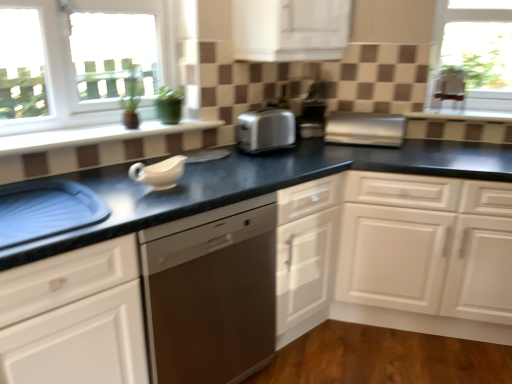
What is the approximate width of white matte cabinet at center, which appears as the 2th cabinetry when viewed from the top?

white matte cabinet at center, which appears as the 2th cabinetry when viewed from the top, is 61.56 centimeters wide.

At what (x,y) coordinates should I click in order to perform the action: click on white ceramic window sill at upper left. Please return your answer as a coordinate pair (x, y). The image size is (512, 384). Looking at the image, I should click on (94, 135).

At what (x,y) coordinates should I click in order to perform the action: click on satin silver coffee machine at center. Please return your answer as a coordinate pair (x, y). This screenshot has width=512, height=384. Looking at the image, I should click on (314, 111).

From the picture: Measure the distance between satin silver coffee machine at center and camera.

The depth of satin silver coffee machine at center is 7.94 feet.

Measure the distance between point (342, 44) and camera.

The distance of point (342, 44) from camera is 7.00 feet.

In order to face white glossy cabinet at upper center, the second cabinetry ordered from the bottom, should I rotate leftwards or rightwards?

It's best to rotate right around 5.376 degrees.

The height and width of the screenshot is (384, 512). Find the location of `satin silver toaster at center`. satin silver toaster at center is located at coordinates (265, 130).

Is white glossy cabinet at upper center, the 1th cabinetry when ordered from top to bottom, smaller than satin silver toaster at center?

Incorrect, white glossy cabinet at upper center, the 1th cabinetry when ordered from top to bottom, is not smaller in size than satin silver toaster at center.

Considering the relative sizes of white glossy cabinet at upper center, the 1th cabinetry when ordered from top to bottom, and satin silver toaster at center in the image provided, is white glossy cabinet at upper center, the 1th cabinetry when ordered from top to bottom, thinner than satin silver toaster at center?

No.

Is white glossy cabinet at upper center, the 1th cabinetry when ordered from top to bottom, inside or outside of satin silver toaster at center?

The correct answer is: outside.

Considering the points (309, 59) and (372, 114), which point is in front, point (309, 59) or point (372, 114)?

The point (309, 59) is closer to the camera.

From a real-world perspective, between stainless steel dishwasher at center and satin silver coffee machine at center, who is vertically higher?

From a 3D spatial view, satin silver coffee machine at center is above.

Could you tell me if stainless steel dishwasher at center is turned towards satin silver coffee machine at center?

No, stainless steel dishwasher at center is not aimed at satin silver coffee machine at center.

Does stainless steel dishwasher at center have a greater height compared to satin silver coffee machine at center?

Yes.

Considering the relative sizes of white glossy cabinet at upper center, the second cabinetry ordered from the bottom, and blue plastic tray at lower left in the image provided, is white glossy cabinet at upper center, the second cabinetry ordered from the bottom, smaller than blue plastic tray at lower left?

Actually, white glossy cabinet at upper center, the second cabinetry ordered from the bottom, might be larger than blue plastic tray at lower left.

Is white glossy cabinet at upper center, the second cabinetry ordered from the bottom, next to blue plastic tray at lower left and touching it?

No, white glossy cabinet at upper center, the second cabinetry ordered from the bottom, is not beside blue plastic tray at lower left.

How different are the orientations of white glossy cabinet at upper center, the 1th cabinetry when ordered from top to bottom, and blue plastic tray at lower left in degrees?

0.294 degrees.

Looking at this image, is white glossy cabinet at upper center, the second cabinetry ordered from the bottom, positioned with its back to blue plastic tray at lower left?

No, white glossy cabinet at upper center, the second cabinetry ordered from the bottom,'s orientation is not away from blue plastic tray at lower left.

Considering the sizes of blue plastic tray at lower left and satin silver toaster at center in the image, is blue plastic tray at lower left bigger or smaller than satin silver toaster at center?

Clearly, blue plastic tray at lower left is larger in size than satin silver toaster at center.

Measure the distance between blue plastic tray at lower left and satin silver toaster at center.

blue plastic tray at lower left is 4.60 feet away from satin silver toaster at center.

Consider the image. Is blue plastic tray at lower left turned away from satin silver toaster at center?

No, satin silver toaster at center is not at the back of blue plastic tray at lower left.

Consider the image. Who is bigger, white ceramic window sill at upper left or satin silver coffee machine at center?

With larger size is white ceramic window sill at upper left.

Is white ceramic window sill at upper left not inside satin silver coffee machine at center?

Yes, white ceramic window sill at upper left is outside of satin silver coffee machine at center.

From a real-world perspective, which is physically below, white ceramic window sill at upper left or satin silver coffee machine at center?

white ceramic window sill at upper left.

Is satin silver coffee machine at center smaller than stainless steel dishwasher at center?

Correct, satin silver coffee machine at center occupies less space than stainless steel dishwasher at center.

I want to click on dishwasher beneath the satin silver coffee machine at center (from a real-world perspective), so click(211, 293).

Between satin silver coffee machine at center and stainless steel dishwasher at center, which one appears on the left side from the viewer's perspective?

From the viewer's perspective, stainless steel dishwasher at center appears more on the left side.

From the image's perspective, is satin silver coffee machine at center above stainless steel dishwasher at center?

Yes, from the image's perspective, satin silver coffee machine at center is above stainless steel dishwasher at center.

Does stainless steel dishwasher at center have a smaller size compared to satin silver toaster at center?

No, stainless steel dishwasher at center is not smaller than satin silver toaster at center.

Which of these two, stainless steel dishwasher at center or satin silver toaster at center, is thinner?

satin silver toaster at center is thinner.

Considering their positions, is stainless steel dishwasher at center located in front of or behind satin silver toaster at center?

Visually, stainless steel dishwasher at center is located in front of satin silver toaster at center.

From the image's perspective, which one is positioned lower, stainless steel dishwasher at center or satin silver toaster at center?

stainless steel dishwasher at center.

In the image, there is a white glossy cabinet at upper center, the 1th cabinetry when ordered from top to bottom. At what (x,y) coordinates should I click in order to perform the action: click on appliance below it (from the image's perspective). Please return your answer as a coordinate pair (x, y). The width and height of the screenshot is (512, 384). Looking at the image, I should click on (365, 129).

Where is `dishwasher directly beneath the satin silver coffee machine at center (from a real-world perspective)`? Image resolution: width=512 pixels, height=384 pixels. dishwasher directly beneath the satin silver coffee machine at center (from a real-world perspective) is located at coordinates (211, 293).

When comparing their distances from white matte cabinet at center, positioned as the first cabinetry in bottom-to-top order, does blue plastic tray at lower left or satin silver coffee machine at center seem further?

Among the two, blue plastic tray at lower left is located further to white matte cabinet at center, positioned as the first cabinetry in bottom-to-top order.

From the image, which object appears to be farther from satin silver coffee machine at center, white matte cabinet at center, positioned as the first cabinetry in bottom-to-top order, or satin silver toaster at center?

Based on the image, white matte cabinet at center, positioned as the first cabinetry in bottom-to-top order, appears to be further to satin silver coffee machine at center.

Considering their positions, is white ceramic window sill at upper left positioned further to black granite countertop at center than satin silver coffee machine at center?

Among the two, satin silver coffee machine at center is located further to black granite countertop at center.

Looking at the image, which one is located closer to white matte cabinet at center, positioned as the first cabinetry in bottom-to-top order, stainless steel dishwasher at center or blue plastic tray at lower left?

stainless steel dishwasher at center is closer to white matte cabinet at center, positioned as the first cabinetry in bottom-to-top order.

Estimate the real-world distances between objects in this image. Which object is closer to white ceramic window sill at upper left, black granite countertop at center or white glossy cabinet at upper center, the second cabinetry ordered from the bottom?

Based on the image, black granite countertop at center appears to be nearer to white ceramic window sill at upper left.

From the image, which object appears to be nearer to black granite countertop at center, blue plastic tray at lower left or white ceramic window sill at upper left?

blue plastic tray at lower left is positioned closer to the anchor black granite countertop at center.

Based on the photo, looking at the image, which one is located further to white ceramic window sill at upper left, black granite countertop at center or satin silver coffee machine at center?

satin silver coffee machine at center is further to white ceramic window sill at upper left.

When comparing their distances from stainless steel dishwasher at center, does white glossy cabinet at upper center, the second cabinetry ordered from the bottom, or blue plastic tray at lower left seem further?

Based on the image, white glossy cabinet at upper center, the second cabinetry ordered from the bottom, appears to be further to stainless steel dishwasher at center.

This screenshot has height=384, width=512. In order to click on dishwasher between blue plastic tray at lower left and satin silver toaster at center in the horizontal direction in this screenshot , I will do `click(211, 293)`.

This screenshot has width=512, height=384. I want to click on dishwasher situated between white ceramic window sill at upper left and black granite countertop at center from left to right, so click(211, 293).

Where is `appliance between satin silver coffee machine at center and white matte cabinet at center, positioned as the first cabinetry in bottom-to-top order, vertically`? appliance between satin silver coffee machine at center and white matte cabinet at center, positioned as the first cabinetry in bottom-to-top order, vertically is located at coordinates (365, 129).

Find the location of a particular element. appliance between blue plastic tray at lower left and white matte cabinet at center, which appears as the 2th cabinetry when viewed from the top, from left to right is located at coordinates (365, 129).